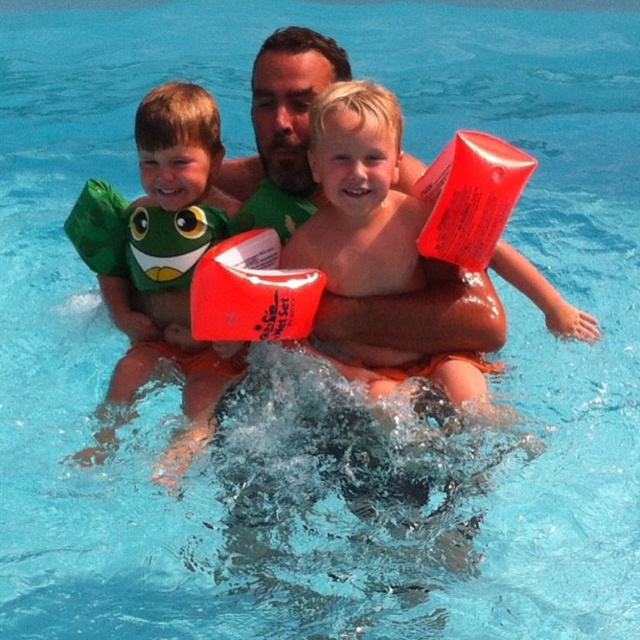
You are a photographer taking a picture of the green rubber arm band at left and the matte green swimsuit at center. Which object will appear larger in your photo?

The green rubber arm band at left appears larger in the photo because it is closer to the viewer than the matte green swimsuit at center.

You are a lifeguard observing the scene. You notice the green rubber arm band at left and the matte green swimsuit at center. Which object is located to the left of the other?

The green rubber arm band at left is positioned on the left side of matte green swimsuit at center.

You are standing on the pool deck and see the green rubber arm band at left. Can you safely pick it up without entering the water?

The green rubber arm band at left is 5.68 meters away from the viewer. Since you are on the pool deck, you would need to enter the water to reach it, so you cannot safely pick it up without entering the water.